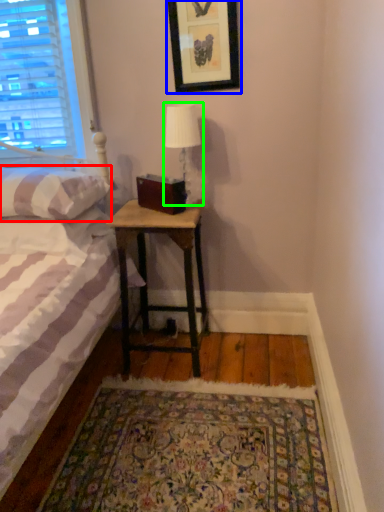
Question: Which object is the closest to the pillow (highlighted by a red box)? Choose among these: picture frame (highlighted by a blue box) or table lamp (highlighted by a green box).

Choices:
 (A) picture frame
 (B) table lamp

Answer: (B)